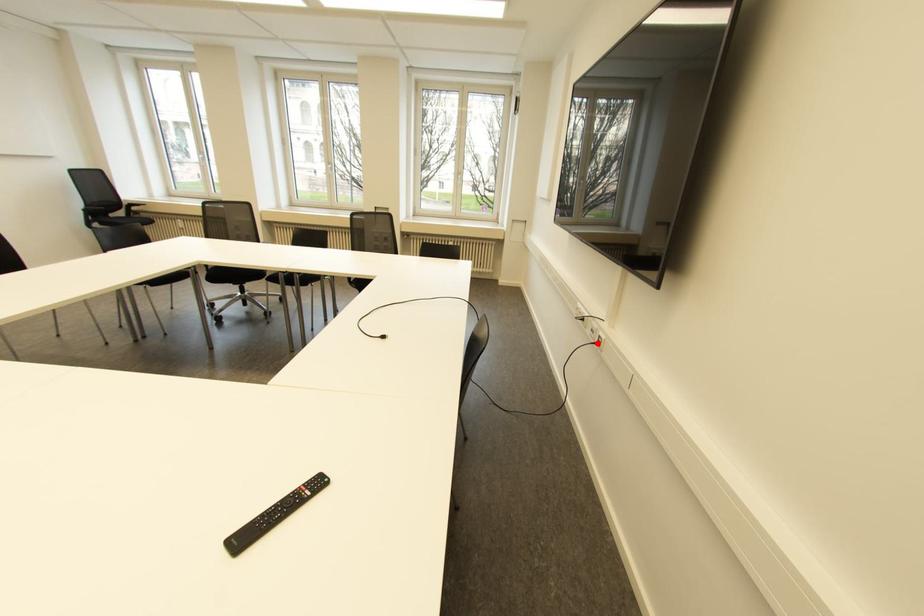
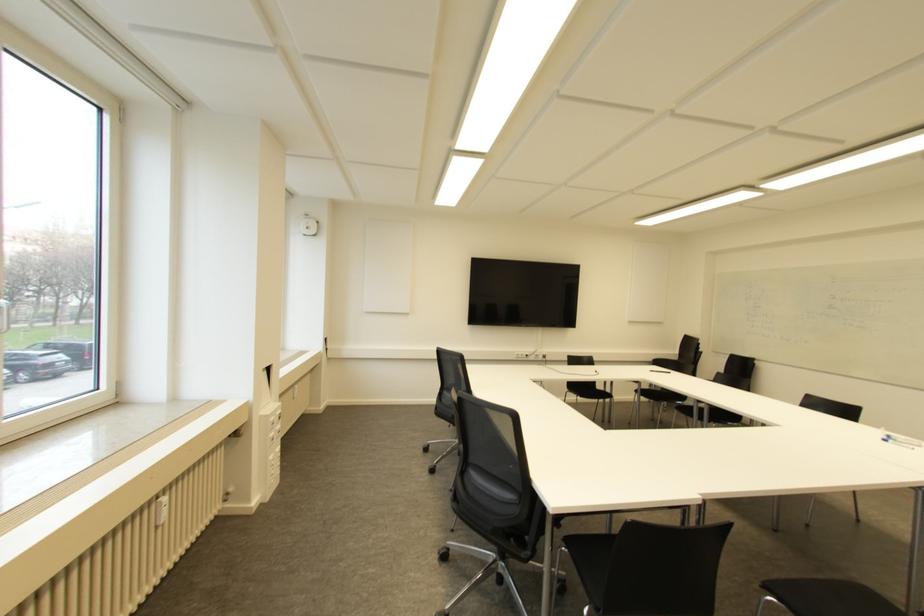
Question: I am providing you with two images of the same scene from different viewpoints. Image1 has a red point marked. In image2, the corresponding 3D location appears at what relative position? Reply with the corresponding letter.

Choices:
 (A) Closer
 (B) Farther

Answer: (B)